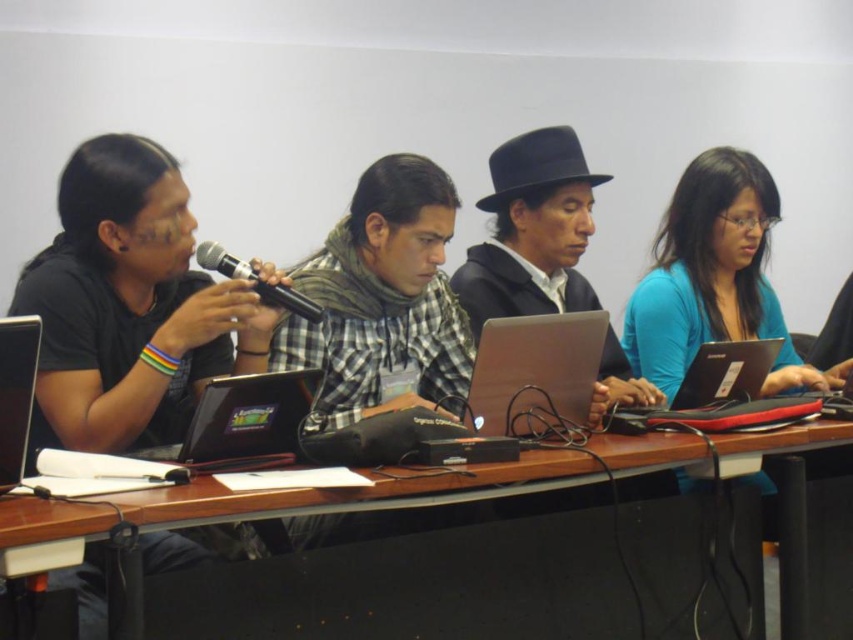
Can you confirm if black matte shirt at left is positioned to the right of blue matte shirt at right?

No, black matte shirt at left is not to the right of blue matte shirt at right.

Can you confirm if black matte shirt at left is bigger than blue matte shirt at right?

Yes.

Between point (149, 563) and point (688, 164), which one is positioned in front?

Point (149, 563)

Identify the location of black matte shirt at left. (125, 305).

Based on the photo, who is more forward, (498,256) or (734,376)?

Point (734,376) is in front.

Which is more to the left, black felt hat at center or black plastic laptop at lower right?

Positioned to the left is black felt hat at center.

Which is behind, point (541, 246) or point (695, 353)?

Positioned behind is point (541, 246).

Locate an element on the screen. black felt hat at center is located at coordinates (531, 230).

Between point (840, 433) and point (486, 205), which one is positioned behind?

Point (486, 205)

Between wooden table at center and black felt hat at center, which one is positioned higher?

black felt hat at center is above.

Does point (633, 472) lie behind point (503, 205)?

No.

The height and width of the screenshot is (640, 853). What are the coordinates of `wooden table at center` in the screenshot? It's located at (291, 497).